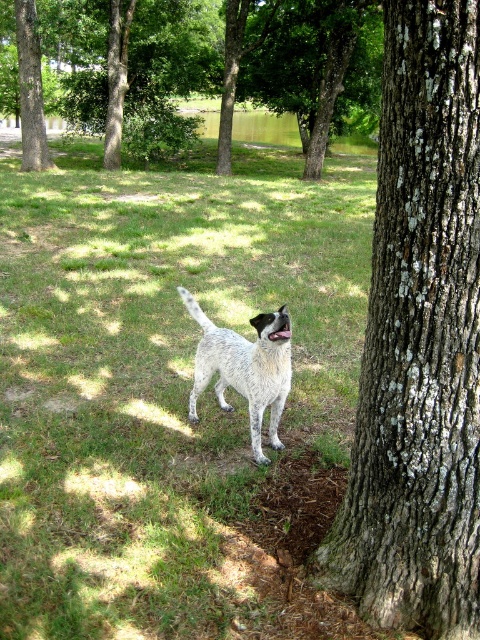
You are a hiker trying to decide which tree to rest under. You see the green bark tree at upper center and the brown rough tree at upper left. Which tree has a wider trunk?

The green bark tree at upper center has a wider trunk than the brown rough tree at upper left, as its width surpasses the latter.

You are standing at the point marked as point (252, 68) in the image. Looking around, you see the green bark tree at upper center. What is the nearest object to you?

The nearest object to you is the green bark tree at upper center located at point (252, 68).